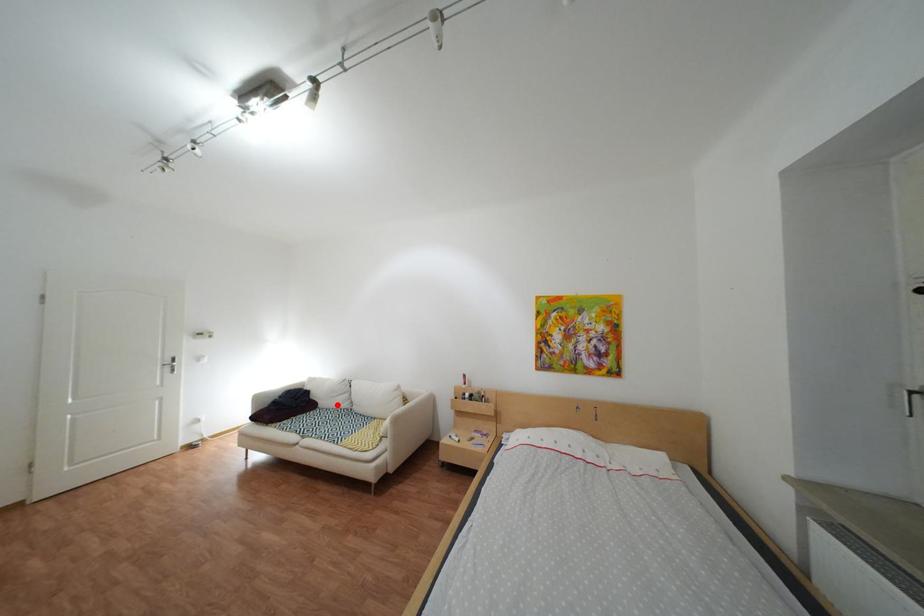
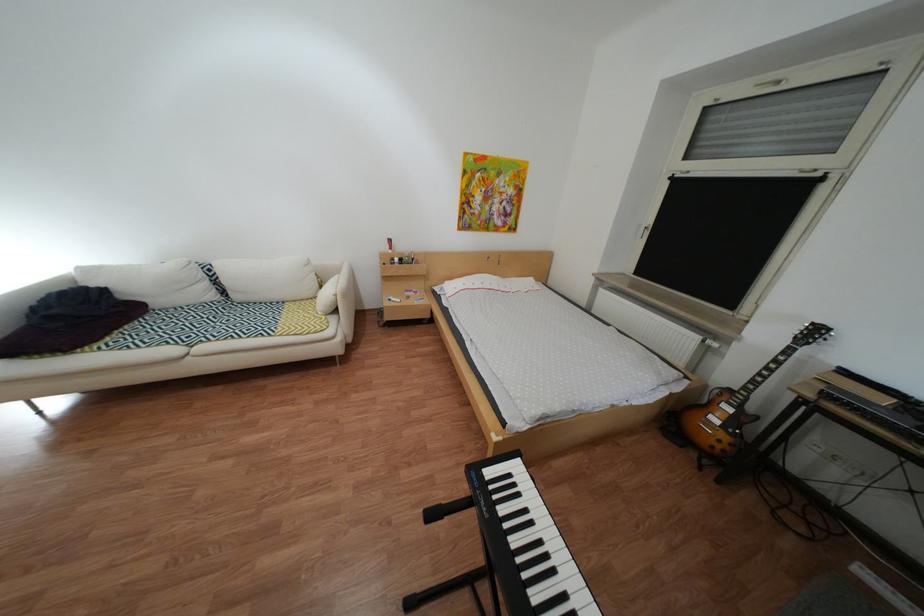
Question: I am providing you with two images of the same scene from different viewpoints. A red point is shown in image1. For the corresponding object point in image2, is it positioned nearer or farther from the camera?

Choices:
 (A) Nearer
 (B) Farther

Answer: (A)